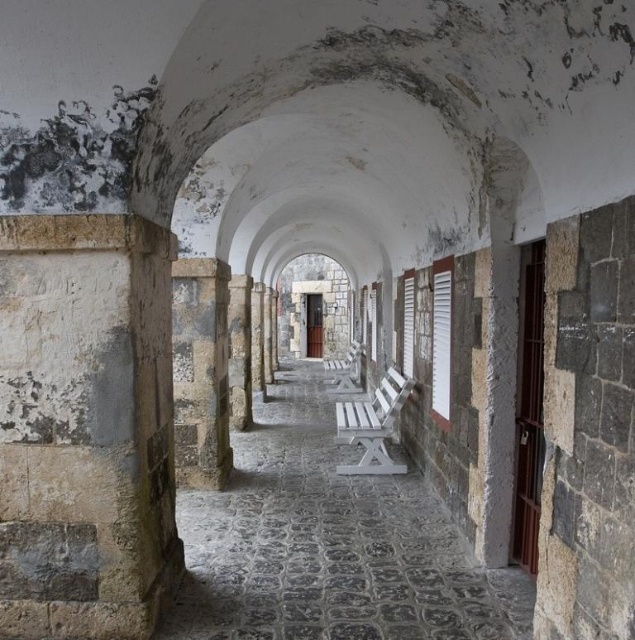
Which is more to the right, white painted wood bench at center or stone textured pillar at center?

From the viewer's perspective, white painted wood bench at center appears more on the right side.

Is white painted wood bench at center positioned before stone textured pillar at center?

No, it is not.

This screenshot has height=640, width=635. Describe the element at coordinates (330, 544) in the screenshot. I see `white painted wood bench at center` at that location.

Find the location of a particular element. The height and width of the screenshot is (640, 635). white painted wood bench at center is located at coordinates (330, 544).